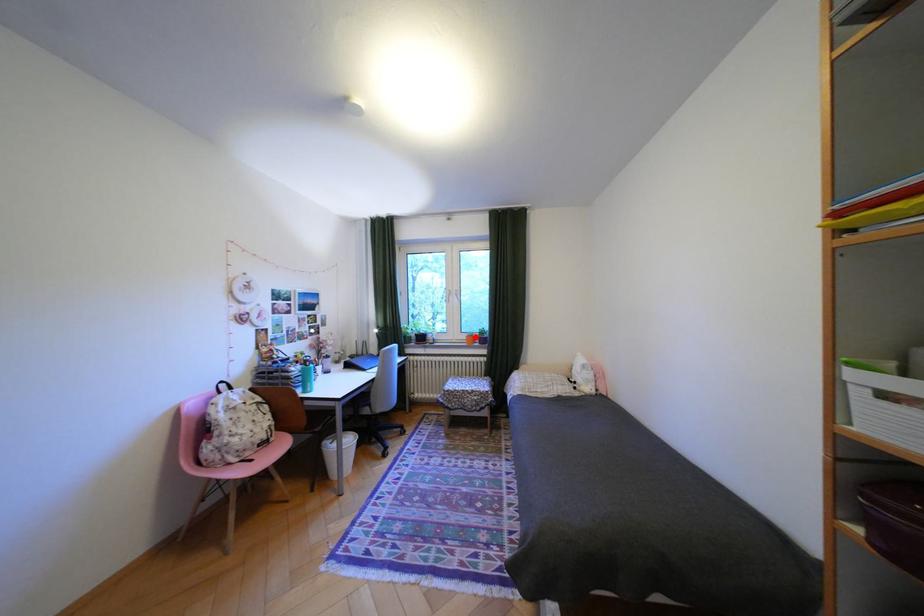
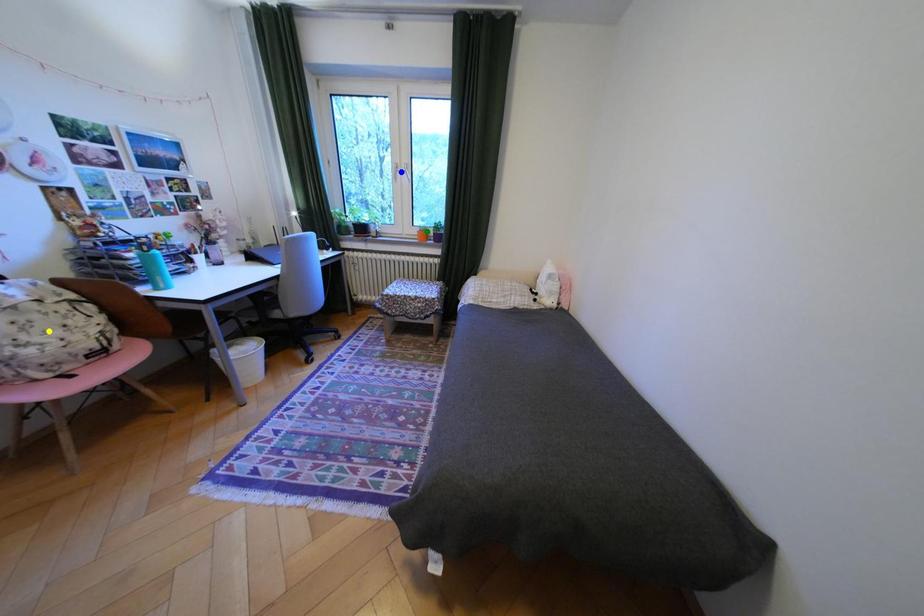
Question: I am providing you with two images of the same scene from different viewpoints. A red point is marked on the first image. You are given multiple points on the second image. Can you choose the point in image 2 that corresponds to the point in image 1?

Choices:
 (A) blue point
 (B) green point
 (C) yellow point

Answer: (B)